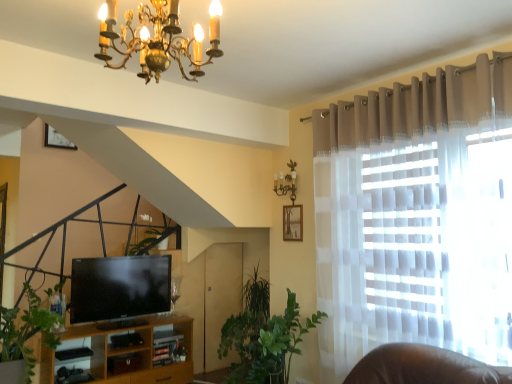
Question: Is matte beige curtain at upper right facing away from green leafy plant at center?

Choices:
 (A) no
 (B) yes

Answer: (A)

Question: From a real-world perspective, is matte beige curtain at upper right physically above green leafy plant at center?

Choices:
 (A) no
 (B) yes

Answer: (B)

Question: Is green leafy plant at center located within matte beige curtain at upper right?

Choices:
 (A) yes
 (B) no

Answer: (B)

Question: From the image's perspective, is matte beige curtain at upper right below green leafy plant at center?

Choices:
 (A) no
 (B) yes

Answer: (A)

Question: Is matte beige curtain at upper right taller than green leafy plant at center?

Choices:
 (A) no
 (B) yes

Answer: (B)

Question: Is matte beige curtain at upper right facing towards green leafy plant at center?

Choices:
 (A) no
 (B) yes

Answer: (A)

Question: Is green leafy plant at center positioned behind matte beige curtain at upper right?

Choices:
 (A) yes
 (B) no

Answer: (A)

Question: Is green leafy plant at center at the right side of matte beige curtain at upper right?

Choices:
 (A) yes
 (B) no

Answer: (B)

Question: Considering the relative positions of green leafy plant at center and matte beige curtain at upper right in the image provided, is green leafy plant at center to the left of matte beige curtain at upper right from the viewer's perspective?

Choices:
 (A) no
 (B) yes

Answer: (B)

Question: Is green leafy plant at center taller than matte beige curtain at upper right?

Choices:
 (A) no
 (B) yes

Answer: (A)

Question: Is green leafy plant at center thinner than matte beige curtain at upper right?

Choices:
 (A) yes
 (B) no

Answer: (A)

Question: Can you confirm if green leafy plant at center is wider than matte beige curtain at upper right?

Choices:
 (A) yes
 (B) no

Answer: (B)

Question: Considering the positions of green leafy plant at center and matte beige curtain at upper right in the image, is green leafy plant at center taller or shorter than matte beige curtain at upper right?

Choices:
 (A) tall
 (B) short

Answer: (B)